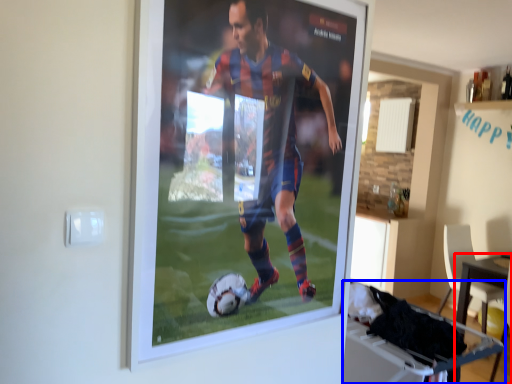
Question: Which of the following is the closest to the observer, table (highlighted by a red box) or table (highlighted by a blue box)?

Choices:
 (A) table
 (B) table

Answer: (B)